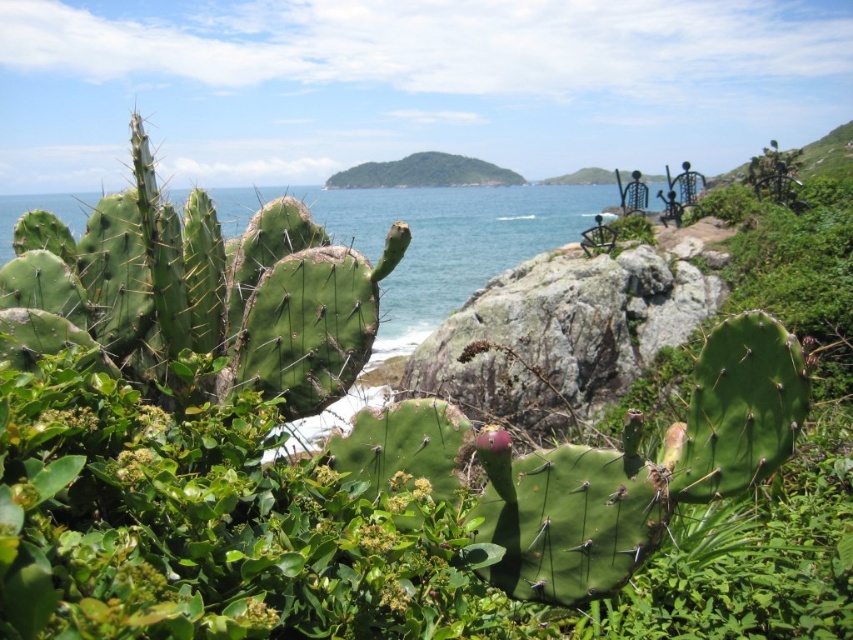
From the picture: You are standing at the point marked as point (560,336) in the coastal landscape. What type of terrain are you currently on?

The terrain at point (560,336) is rocky at center.

You are planning to build a small garden in the rocky area at center. Given that the rocky at center is smaller than the green water at center, which area would be more suitable for planting new shrubs?

The rocky at center is smaller than the green water at center, so the rocky area at center would be more suitable for planting new shrubs since it has less rocky terrain to clear.

You are a hiker trying to cross the rocky terrain in the middle of the image. You see the rocky at center and the green water at center. Which one is closer to you?

The rocky at center is closer to you than the green water at center because the green water at center is positioned behind the rocky at center.